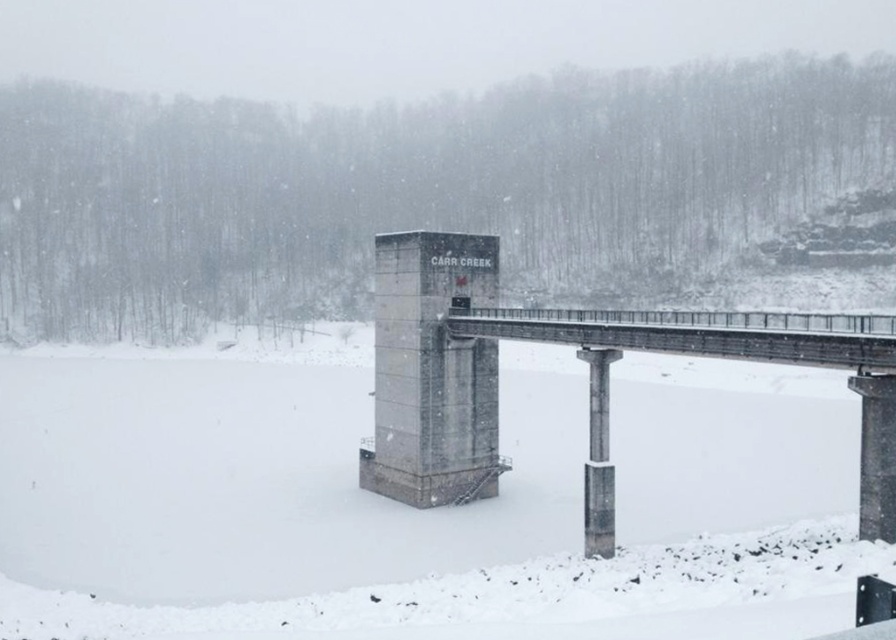
Who is shorter, white matte snow at center or concrete bridge at center?

white matte snow at center is shorter.

Which is in front, point (334, 536) or point (495, 435)?

Positioned in front is point (334, 536).

At what (x,y) coordinates should I click in order to perform the action: click on white matte snow at center. Please return your answer as a coordinate pair (x, y). Looking at the image, I should click on (397, 502).

Locate an element on the screen. white matte snow at center is located at coordinates [x=397, y=502].